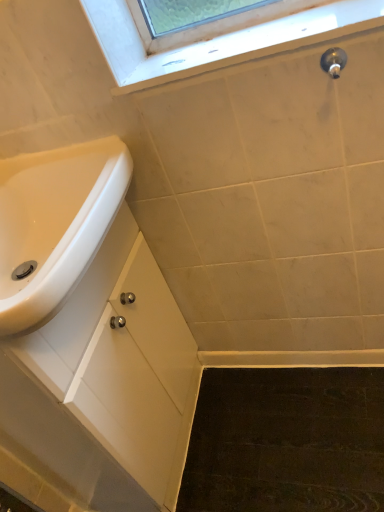
Question: Are polished chrome faucet at upper right and white matte cabinet at lower left making contact?

Choices:
 (A) no
 (B) yes

Answer: (A)

Question: Does polished chrome faucet at upper right have a larger size compared to white matte cabinet at lower left?

Choices:
 (A) no
 (B) yes

Answer: (A)

Question: From a real-world perspective, is polished chrome faucet at upper right under white matte cabinet at lower left?

Choices:
 (A) no
 (B) yes

Answer: (A)

Question: Would you say polished chrome faucet at upper right contains white matte cabinet at lower left?

Choices:
 (A) no
 (B) yes

Answer: (A)

Question: Is polished chrome faucet at upper right in front of white matte cabinet at lower left?

Choices:
 (A) no
 (B) yes

Answer: (A)

Question: From a real-world perspective, is clear glass window at upper center above or below white glossy sink at lower left?

Choices:
 (A) below
 (B) above

Answer: (B)

Question: In the image, is clear glass window at upper center on the left side or the right side of white glossy sink at lower left?

Choices:
 (A) left
 (B) right

Answer: (B)

Question: Considering the positions of clear glass window at upper center and white glossy sink at lower left in the image, is clear glass window at upper center taller or shorter than white glossy sink at lower left?

Choices:
 (A) tall
 (B) short

Answer: (B)

Question: In terms of width, does clear glass window at upper center look wider or thinner when compared to white glossy sink at lower left?

Choices:
 (A) thin
 (B) wide

Answer: (A)

Question: From a real-world perspective, is white glossy sink at lower left physically located above or below clear glass window at upper center?

Choices:
 (A) above
 (B) below

Answer: (B)

Question: Is point (51, 230) positioned closer to the camera than point (281, 23)?

Choices:
 (A) closer
 (B) farther

Answer: (B)

Question: Looking at their shapes, would you say white glossy sink at lower left is wider or thinner than clear glass window at upper center?

Choices:
 (A) wide
 (B) thin

Answer: (A)

Question: Relative to clear glass window at upper center, is white glossy sink at lower left in front or behind?

Choices:
 (A) behind
 (B) front

Answer: (B)

Question: Is white glossy sink at lower left to the left or to the right of polished chrome faucet at upper right in the image?

Choices:
 (A) left
 (B) right

Answer: (A)

Question: Do you think white glossy sink at lower left is within polished chrome faucet at upper right, or outside of it?

Choices:
 (A) outside
 (B) inside

Answer: (A)